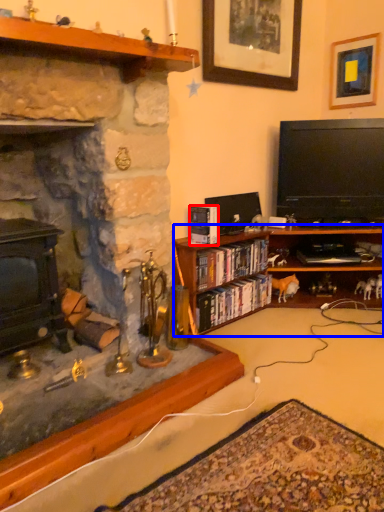
Question: Which object appears farthest to the camera in this image, book (highlighted by a red box) or cabinetry (highlighted by a blue box)?

Choices:
 (A) book
 (B) cabinetry

Answer: (A)